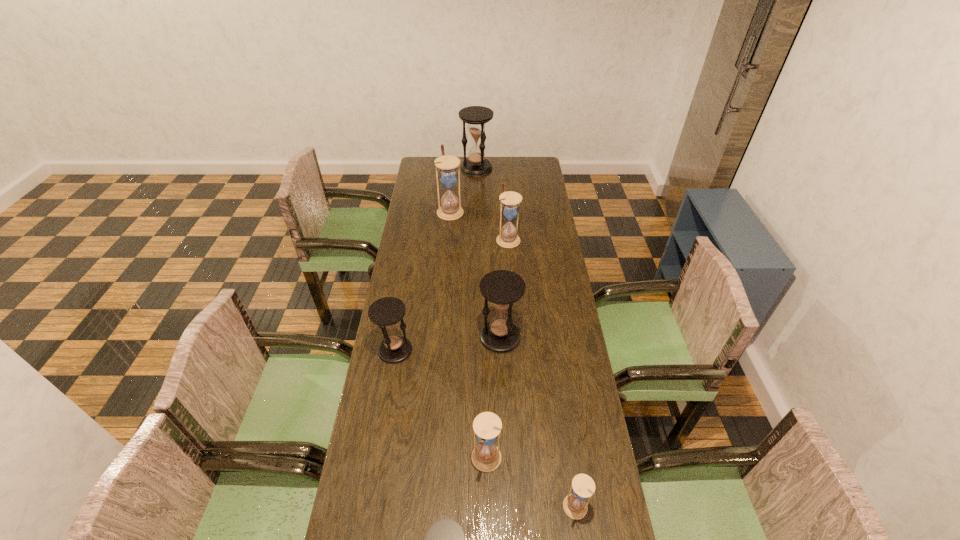
The image size is (960, 540). Identify the location of free location that satisfies the following two spatial constraints: 1. on the back side of the leftmost object; 2. on the left side of the third farthest hourglass. (414, 239).